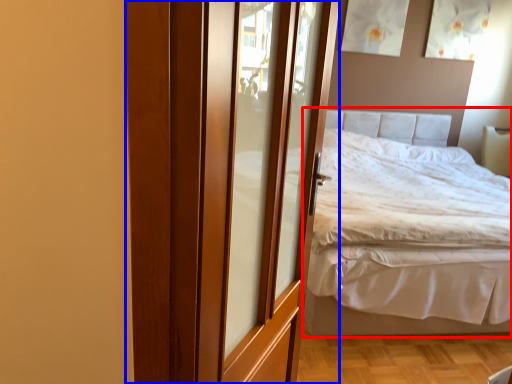
Question: Which point is further to the camera, bed (highlighted by a red box) or door (highlighted by a blue box)?

Choices:
 (A) bed
 (B) door

Answer: (A)